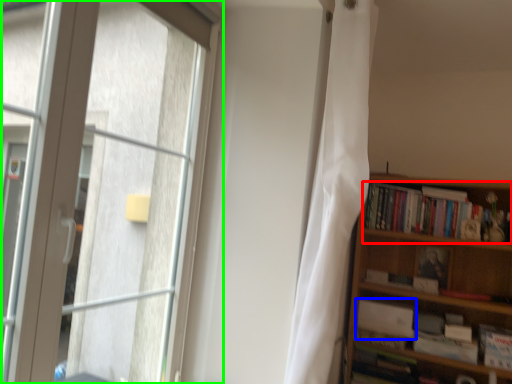
Question: Based on their relative distances, which object is nearer to book (highlighted by a red box)? Choose from book (highlighted by a blue box) and window (highlighted by a green box).

Choices:
 (A) book
 (B) window

Answer: (A)